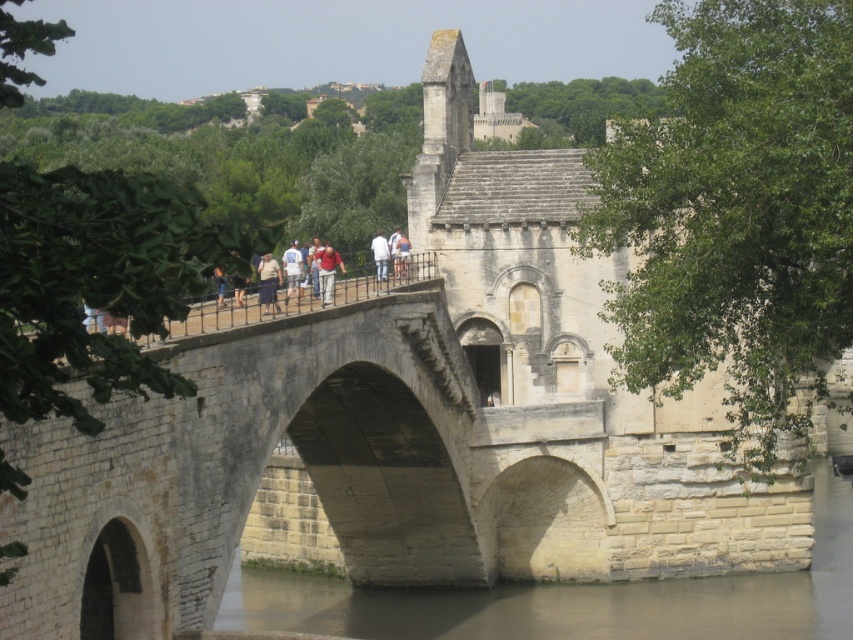
You are standing on the historic stone bridge and notice a person wearing a red shirt at center and light blue jeans at center. Which piece of clothing is nearer to you?

The red shirt at center is closer to the viewer than the light blue jeans at center, so the red shirt at center is nearer to you.

You are standing on the historic stone bridge and notice two people wearing a red shirt at center and a light brown leather jacket at center. Which person is taller?

The red shirt at center is taller than the light brown leather jacket at center.